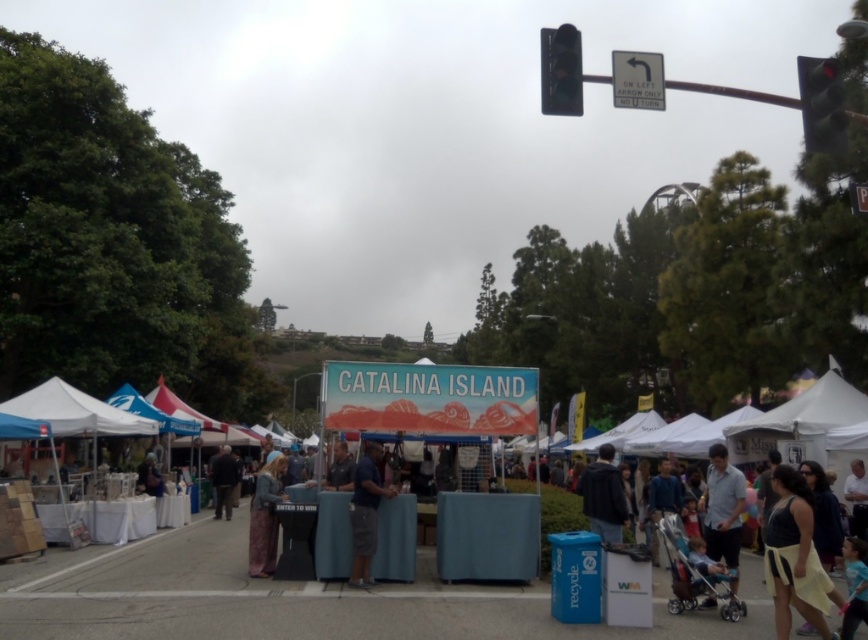
Question: Which of the following is the farthest from the observer?

Choices:
 (A) light blue shirt at center
 (B) dark gray jacket at center
 (C) blue fabric booth at center
 (D) red glass traffic light at upper right

Answer: (B)

Question: Can you confirm if red glass traffic light at upper right is positioned to the left of black plastic traffic light at upper right?

Choices:
 (A) no
 (B) yes

Answer: (A)

Question: Which point is closer to the camera taking this photo?

Choices:
 (A) (268, 460)
 (B) (367, 550)
 (C) (814, 64)
 (D) (597, 486)

Answer: (C)

Question: Is dark gray jacket at center positioned behind gray fabric pants at center?

Choices:
 (A) yes
 (B) no

Answer: (B)

Question: Is blue fabric booth at center above dark gray jacket at center?

Choices:
 (A) no
 (B) yes

Answer: (B)

Question: Which point is closer to the camera?

Choices:
 (A) gray fabric pants at center
 (B) blue fabric booth at center
 (C) yellow fabric dress at lower right
 (D) light blue shirt at center

Answer: (C)